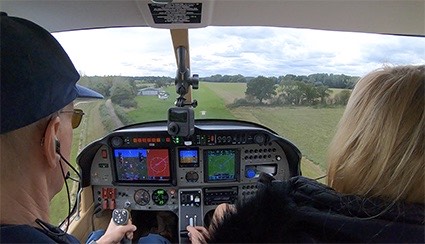
At what (x,y) coordinates should I click in order to perform the action: click on flip switch. Please return your answer as a coordinate pair (x, y). This screenshot has height=244, width=425. Looking at the image, I should click on (107, 198).